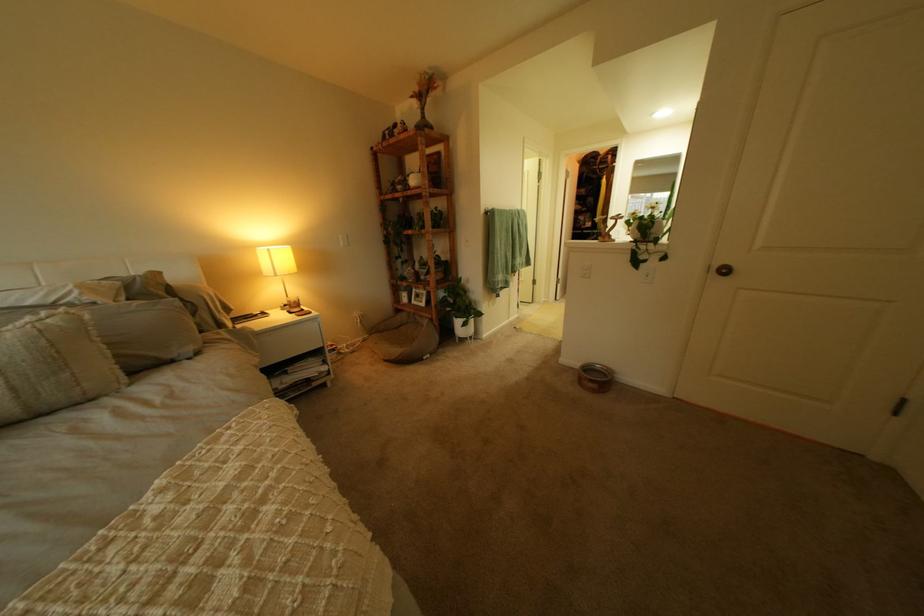
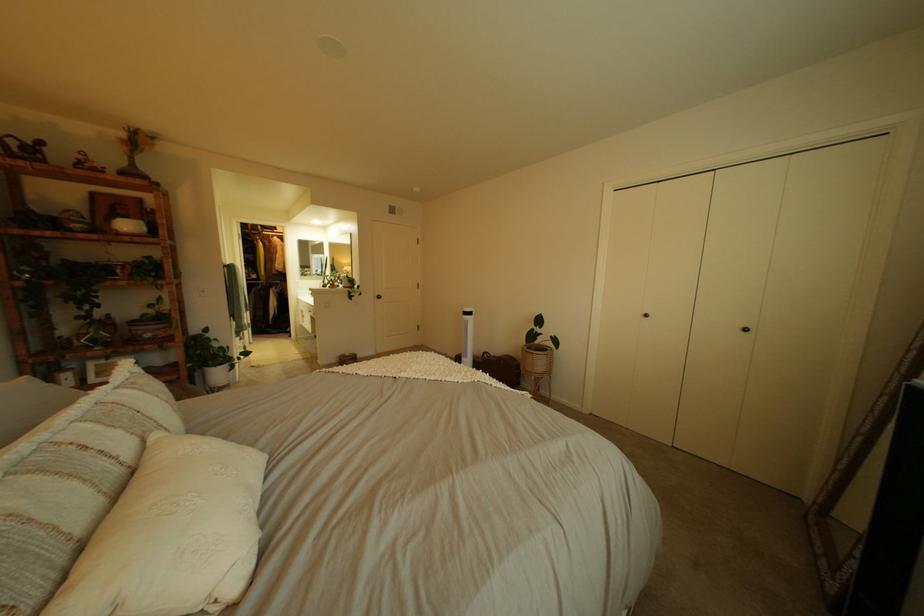
In the second image, find the point that corresponds to the point at 432,90 in the first image.

(139, 137)